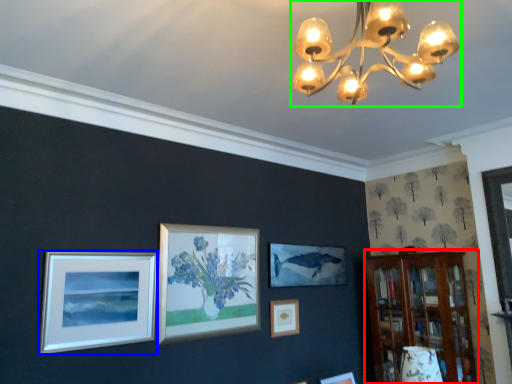
Question: Considering the real-world distances, which object is farthest from bookshelf (highlighted by a red box)? picture frame (highlighted by a blue box) or lamp (highlighted by a green box)?

Choices:
 (A) picture frame
 (B) lamp

Answer: (B)